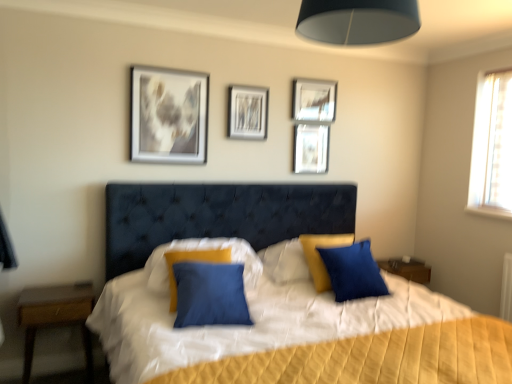
Question: From a real-world perspective, is black fabric lampshade at upper center above or below blue fabric pillow at center, which appears as the 1th pillow when viewed from the right?

Choices:
 (A) below
 (B) above

Answer: (B)

Question: Is black fabric lampshade at upper center in front of or behind blue fabric pillow at center, acting as the 2th pillow starting from the left, in the image?

Choices:
 (A) behind
 (B) front

Answer: (B)

Question: Which object is the farthest from the black fabric lampshade at upper center?

Choices:
 (A) metallic silver picture frame at upper center, the 4th picture frame positioned from the left
 (B) metallic silver picture frame at upper center, the 2th picture frame from the left
 (C) wooden nightstand at left
 (D) matte silver picture frame at upper center, which appears as the 2th picture frame when viewed from the right
 (E) metallic silver picture frame at upper center, the 4th picture frame from the right

Answer: (C)

Question: Which is farther from the blue fabric pillow at center, acting as the 2th pillow starting from the left?

Choices:
 (A) metallic silver picture frame at upper center, the 2th picture frame from the left
 (B) matte silver picture frame at upper center, which appears as the 2th picture frame when viewed from the right
 (C) metallic silver picture frame at upper center, the first picture frame positioned from the left
 (D) wooden nightstand at left
 (E) black fabric lampshade at upper center

Answer: (D)